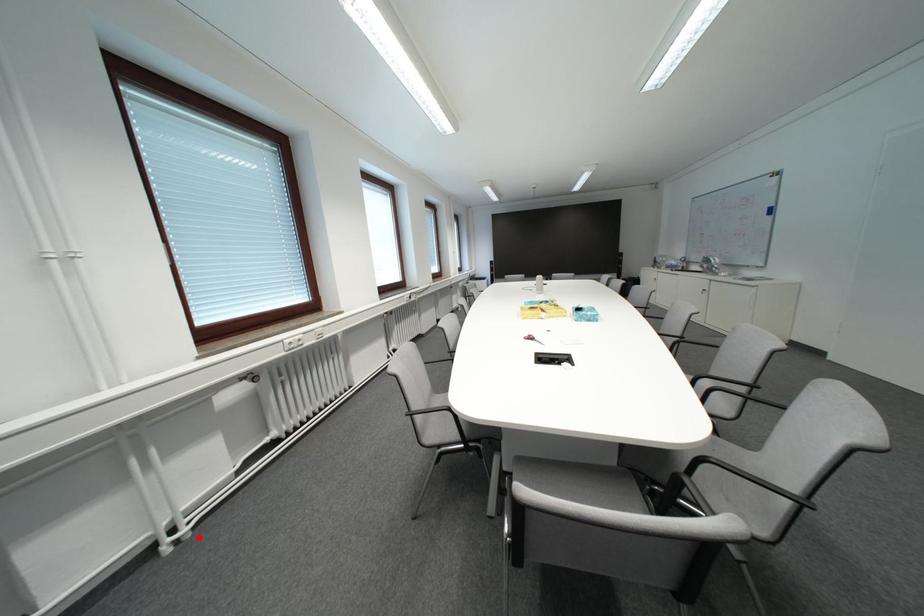
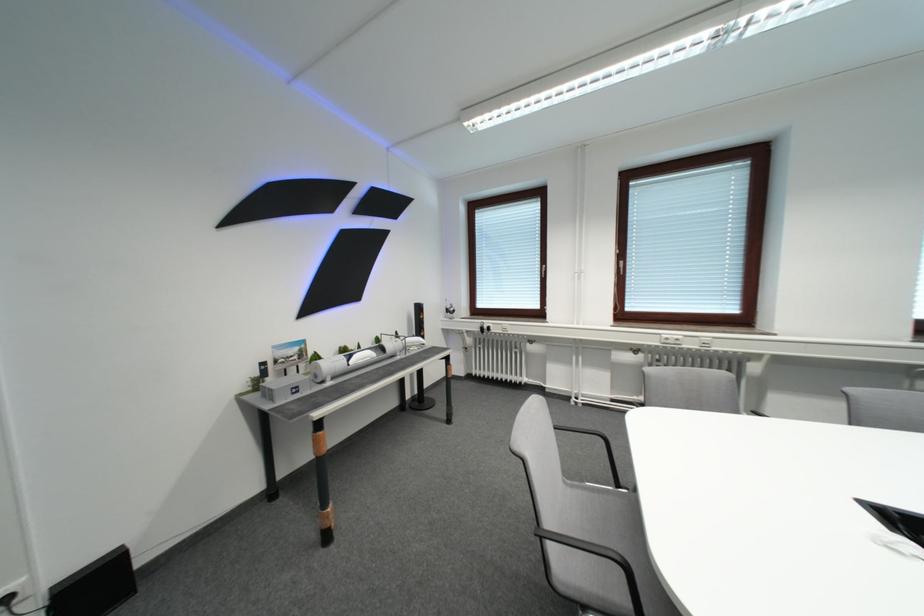
Question: I am providing you with two images of the same scene from different viewpoints. A red point is marked on the first image. Can you still see the location of the red point in image 2?

Choices:
 (A) Yes
 (B) No

Answer: (A)